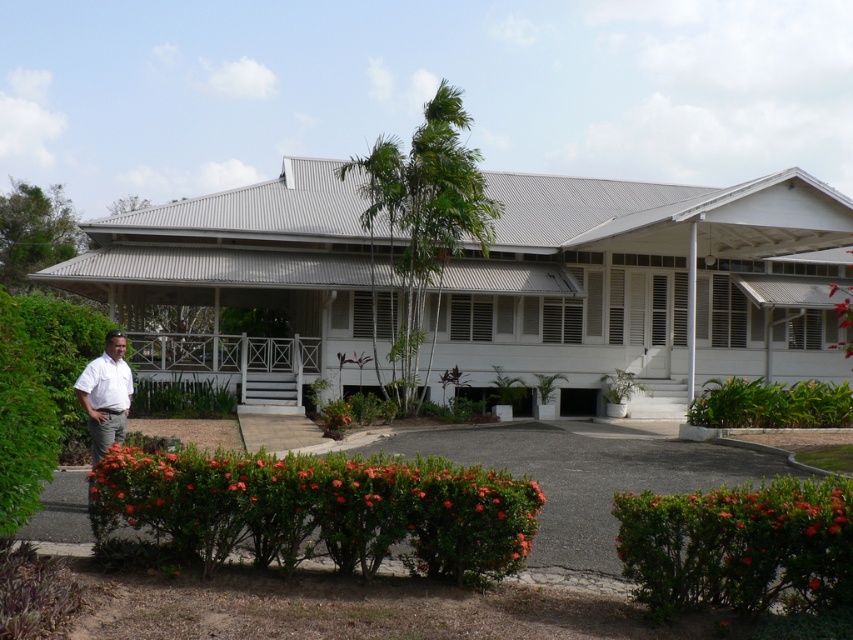
Question: Can you confirm if white wooden porch at center is thinner than white shirt at left?

Choices:
 (A) no
 (B) yes

Answer: (A)

Question: Which point is closer to the camera?

Choices:
 (A) white wooden porch at center
 (B) white shirt at left

Answer: (B)

Question: Is white wooden porch at center bigger than white shirt at left?

Choices:
 (A) no
 (B) yes

Answer: (B)

Question: Which of the following is the closest to the observer?

Choices:
 (A) white wooden porch at center
 (B) white shirt at left

Answer: (B)

Question: Does white wooden porch at center have a larger size compared to white shirt at left?

Choices:
 (A) yes
 (B) no

Answer: (A)

Question: Which of the following is the closest to the observer?

Choices:
 (A) white shirt at left
 (B) white wooden porch at center

Answer: (A)